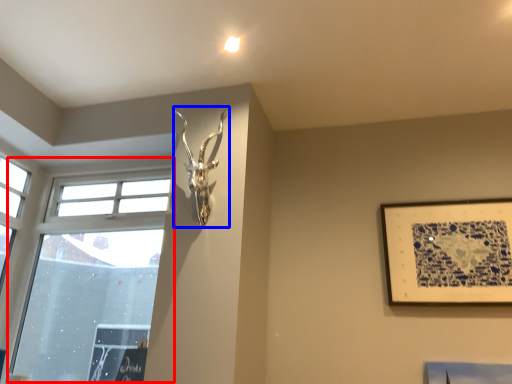
Question: Which object is closer to the camera taking this photo, window (highlighted by a red box) or sculpture (highlighted by a blue box)?

Choices:
 (A) window
 (B) sculpture

Answer: (B)